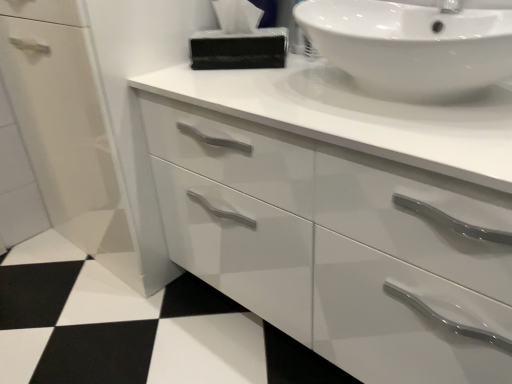
Question: Choose the correct answer: Is black glossy tissue at upper center inside white glossy sink at upper right or outside it?

Choices:
 (A) inside
 (B) outside

Answer: (B)

Question: From the image's perspective, is black glossy tissue at upper center located above or below white glossy sink at upper right?

Choices:
 (A) above
 (B) below

Answer: (A)

Question: Is black glossy tissue at upper center bigger or smaller than white glossy sink at upper right?

Choices:
 (A) big
 (B) small

Answer: (B)

Question: Is white glossy sink at upper right situated inside black glossy tissue at upper center or outside?

Choices:
 (A) inside
 (B) outside

Answer: (B)

Question: In terms of height, does white glossy sink at upper right look taller or shorter compared to black glossy tissue at upper center?

Choices:
 (A) tall
 (B) short

Answer: (A)

Question: Considering their positions, is white glossy sink at upper right located in front of or behind black glossy tissue at upper center?

Choices:
 (A) front
 (B) behind

Answer: (A)

Question: Does point (480, 61) appear closer or farther from the camera than point (206, 44)?

Choices:
 (A) closer
 (B) farther

Answer: (A)